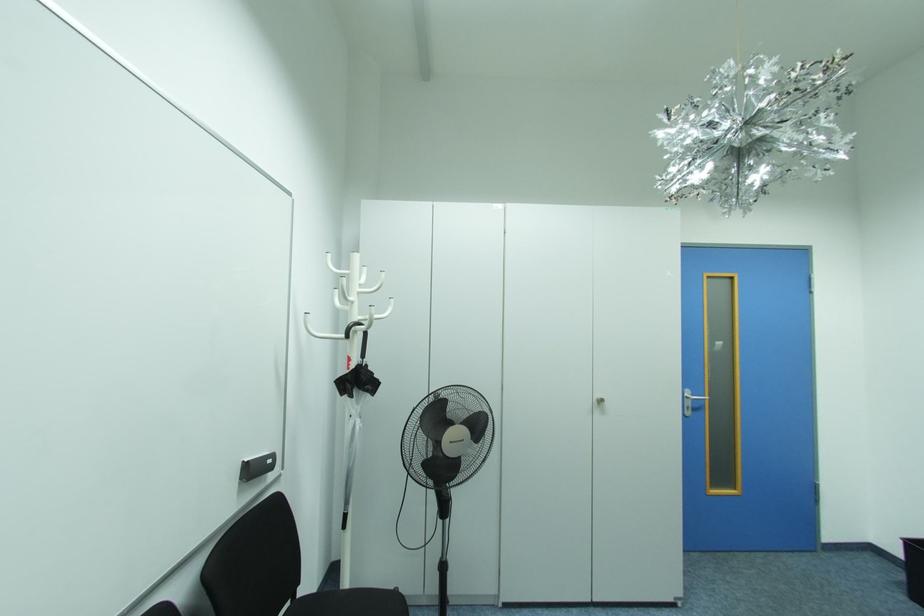
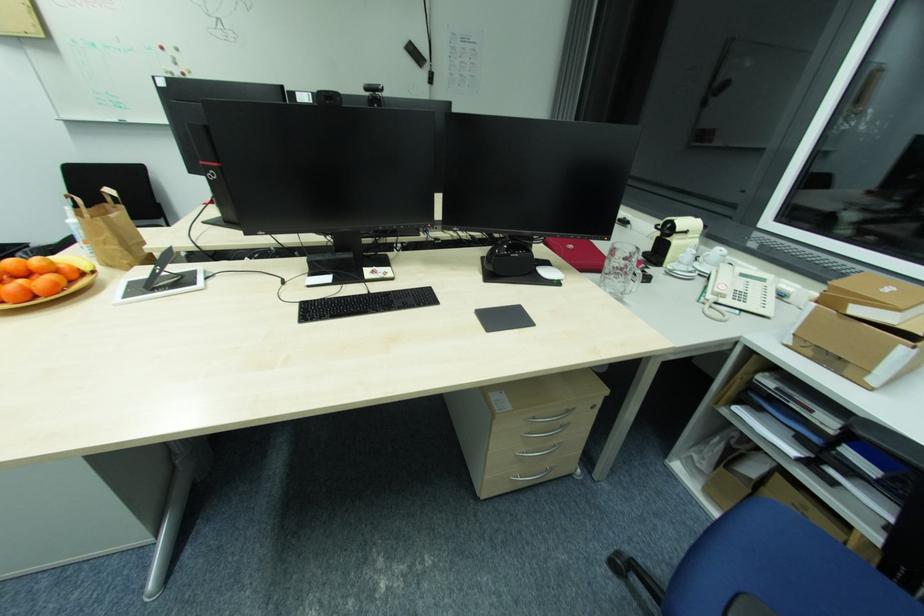
The first image is from the beginning of the video and the second image is from the end. How did the camera likely rotate when shooting the video?

The camera rotated toward right-down.